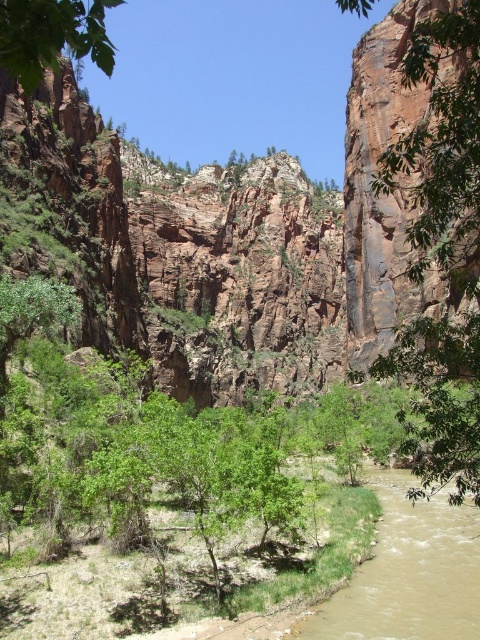
Question: Which object is the farthest from the green leafy tree at right?

Choices:
 (A) green leafy tree at upper left
 (B) brown muddy water at lower center

Answer: (A)

Question: Is brown muddy water at lower center thinner than green leafy tree at upper left?

Choices:
 (A) no
 (B) yes

Answer: (B)

Question: Estimate the real-world distances between objects in this image. Which object is closer to the brown muddy water at lower center?

Choices:
 (A) green leafy tree at upper left
 (B) green leafy tree at right

Answer: (B)

Question: Which of the following is the farthest from the observer?

Choices:
 (A) (460, 36)
 (B) (21, 74)

Answer: (A)

Question: Is green leafy tree at right further to the viewer compared to brown muddy water at lower center?

Choices:
 (A) no
 (B) yes

Answer: (A)

Question: Is green leafy tree at right smaller than green leafy tree at upper left?

Choices:
 (A) yes
 (B) no

Answer: (A)